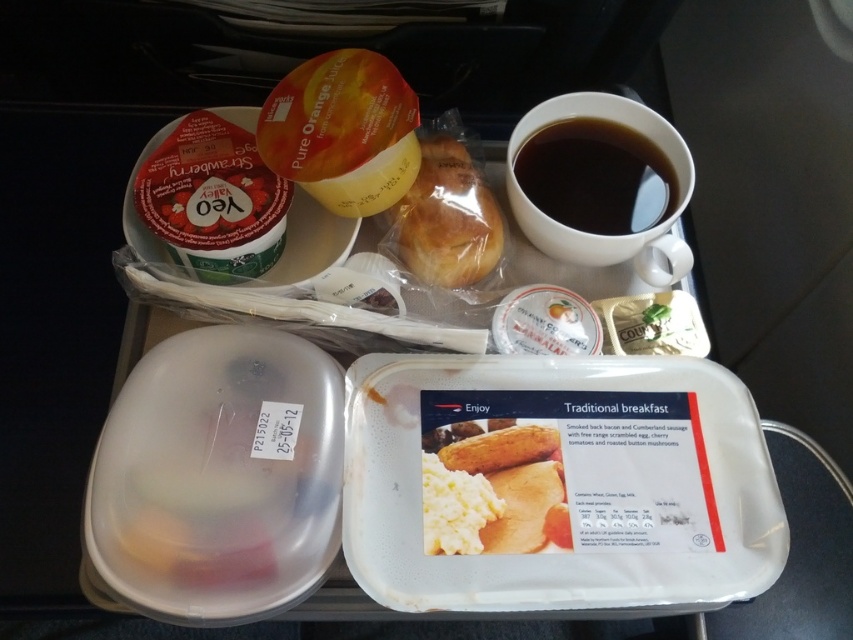
Can you confirm if white fluffy scrambled egg at center is positioned to the right of golden brown bread at upper center?

Correct, you'll find white fluffy scrambled egg at center to the right of golden brown bread at upper center.

Describe the element at coordinates (494, 490) in the screenshot. I see `white fluffy scrambled egg at center` at that location.

Identify the location of white fluffy scrambled egg at center. (494, 490).

Which of these two, white fluffy scrambled egg at center or black glossy cup at upper right, stands taller?

With more height is black glossy cup at upper right.

Is white fluffy scrambled egg at center to the left of black glossy cup at upper right from the viewer's perspective?

Yes, white fluffy scrambled egg at center is to the left of black glossy cup at upper right.

In order to click on white fluffy scrambled egg at center in this screenshot , I will do `click(494, 490)`.

Which is above, black glossy cup at upper right or golden brown bread at upper center?

Positioned higher is black glossy cup at upper right.

Is black glossy cup at upper right below golden brown bread at upper center?

Actually, black glossy cup at upper right is above golden brown bread at upper center.

Is point (592, 204) behind point (437, 134)?

No, it is not.

Where is `black glossy cup at upper right`? Image resolution: width=853 pixels, height=640 pixels. black glossy cup at upper right is located at coordinates (596, 177).